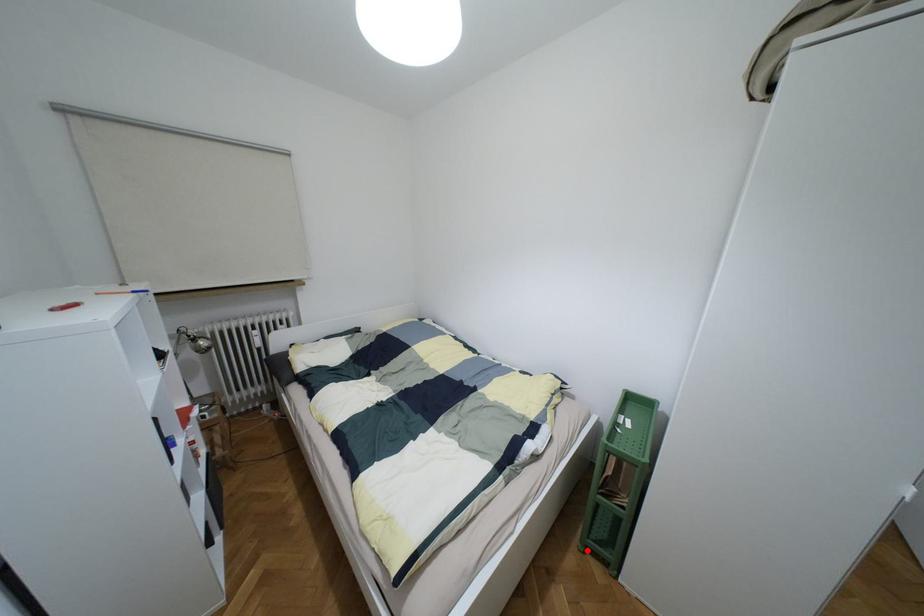
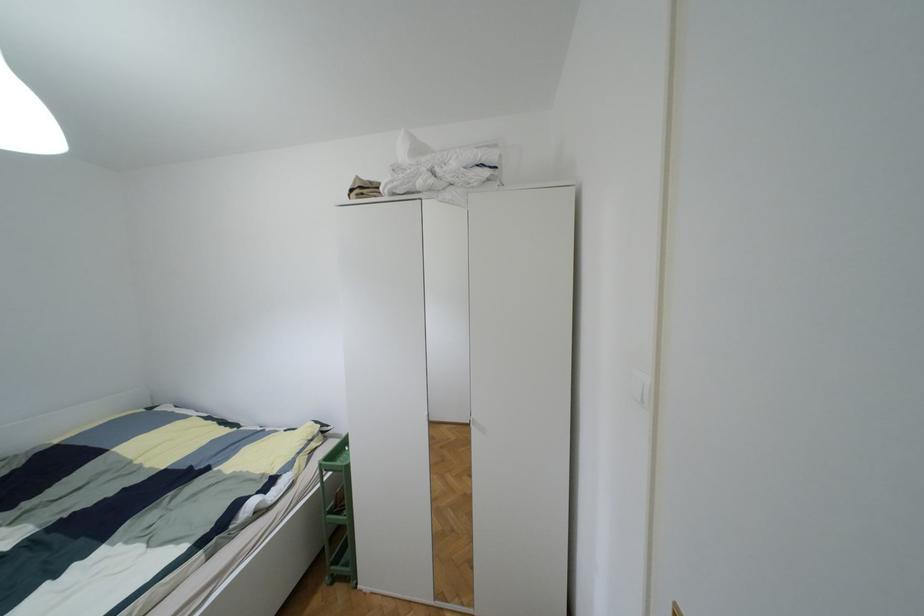
The point at the highlighted location is marked in the first image. Where is the corresponding point in the second image?

(333, 578)